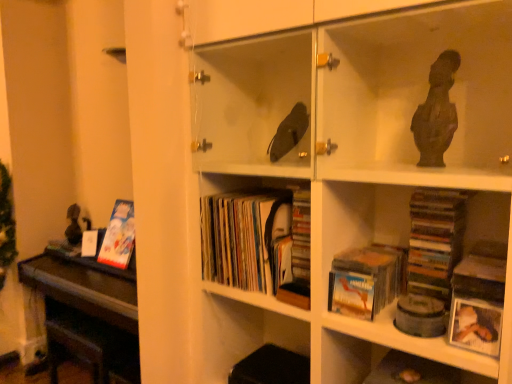
Question: From a real-world perspective, is matte cardboard book at left, the 1th book positioned from the left, positioned under white matte photo frame at lower right based on gravity?

Choices:
 (A) yes
 (B) no

Answer: (A)

Question: Does matte cardboard book at left, which is the third book from right to left, have a greater height compared to white matte photo frame at lower right?

Choices:
 (A) yes
 (B) no

Answer: (A)

Question: Is matte cardboard book at left, the 1th book positioned from the left, beside white matte photo frame at lower right?

Choices:
 (A) no
 (B) yes

Answer: (A)

Question: Considering the relative sizes of matte cardboard book at left, which is the third book from right to left, and white matte photo frame at lower right in the image provided, is matte cardboard book at left, which is the third book from right to left, wider than white matte photo frame at lower right?

Choices:
 (A) no
 (B) yes

Answer: (B)

Question: Considering the relative sizes of matte cardboard book at left, the 1th book positioned from the left, and white matte photo frame at lower right in the image provided, is matte cardboard book at left, the 1th book positioned from the left, shorter than white matte photo frame at lower right?

Choices:
 (A) no
 (B) yes

Answer: (A)

Question: Can you confirm if matte cardboard book at left, which is the third book from right to left, is thinner than white matte photo frame at lower right?

Choices:
 (A) no
 (B) yes

Answer: (A)

Question: Can you confirm if matte cardboard book at lower center, the third book viewed from the back, is taller than matte cardboard book at left, which is the 3th book from front to back?

Choices:
 (A) yes
 (B) no

Answer: (B)

Question: Considering the relative sizes of matte cardboard book at lower center, the third book viewed from the back, and matte cardboard book at left, which is the third book from right to left, in the image provided, is matte cardboard book at lower center, the third book viewed from the back, wider than matte cardboard book at left, which is the third book from right to left,?

Choices:
 (A) no
 (B) yes

Answer: (B)

Question: Can you confirm if matte cardboard book at lower center, acting as the 1th book starting from the right, is bigger than matte cardboard book at left, the 1th book positioned from the left?

Choices:
 (A) no
 (B) yes

Answer: (A)

Question: Considering the relative positions of matte cardboard book at lower center, arranged as the third book when viewed from the left, and matte cardboard book at left, arranged as the first book when viewed from the back, in the image provided, is matte cardboard book at lower center, arranged as the third book when viewed from the left, in front of matte cardboard book at left, arranged as the first book when viewed from the back,?

Choices:
 (A) yes
 (B) no

Answer: (A)

Question: Is matte cardboard book at lower center, the third book viewed from the back, not within matte cardboard book at left, arranged as the first book when viewed from the back?

Choices:
 (A) yes
 (B) no

Answer: (A)

Question: Is matte cardboard book at lower center, arranged as the third book when viewed from the left, thinner than matte cardboard book at left, arranged as the first book when viewed from the back?

Choices:
 (A) no
 (B) yes

Answer: (A)

Question: Considering the relative sizes of white matte photo frame at lower right and matte cardboard book at left, arranged as the first book when viewed from the back, in the image provided, is white matte photo frame at lower right taller than matte cardboard book at left, arranged as the first book when viewed from the back,?

Choices:
 (A) yes
 (B) no

Answer: (B)